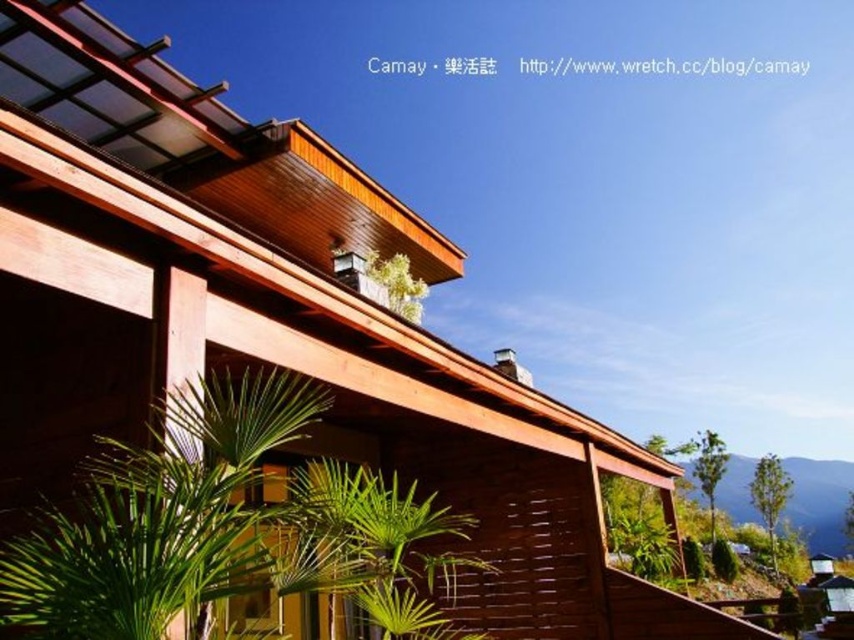
Question: Is green matte plant at upper center above green leafy plant at lower right?

Choices:
 (A) no
 (B) yes

Answer: (B)

Question: Can you confirm if green matte plant at upper center is wider than green leafy plant at lower right?

Choices:
 (A) yes
 (B) no

Answer: (B)

Question: Which of the following is the farthest from the observer?

Choices:
 (A) (718, 557)
 (B) (474, 564)

Answer: (A)

Question: Which point is farther to the camera?

Choices:
 (A) (410, 308)
 (B) (717, 544)
 (C) (294, 500)

Answer: (B)

Question: Which object is closer to the camera taking this photo?

Choices:
 (A) green leafy plant at lower right
 (B) green matte plant at upper center
 (C) green leafy plant at lower left

Answer: (C)

Question: Does green leafy plant at lower left have a smaller size compared to green leafy plant at lower right?

Choices:
 (A) yes
 (B) no

Answer: (B)